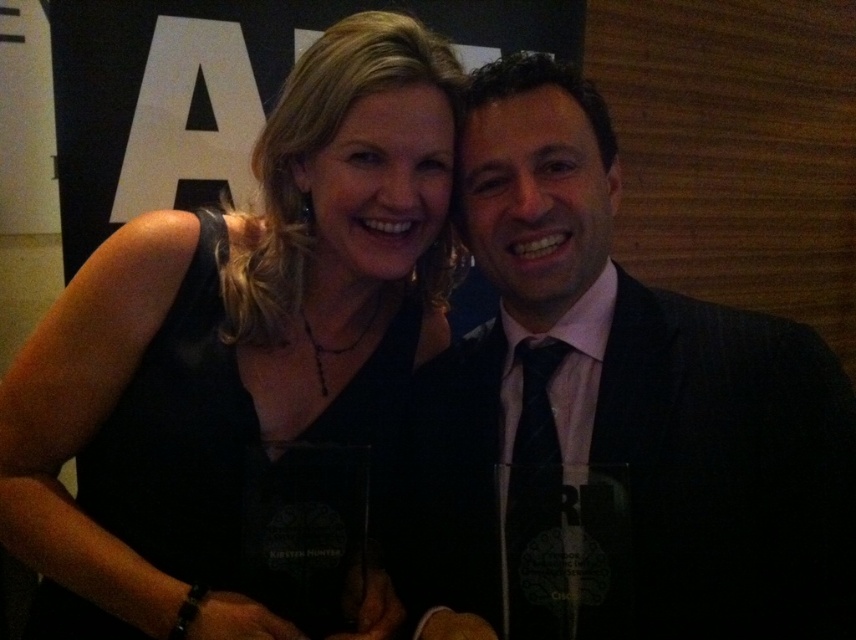
You are a photographer standing 1 meter away from the scene. You want to focus your camera on the black matte dress at center without blurring the people holding awards in the foreground. Is the distance sufficient for your camera to capture both clearly?

The black matte dress at center is 82.94 centimeters away from the viewer. Since you are standing 1 meter away, which is slightly farther than the dress, your camera should be able to focus on the dress while keeping the foreground subjects sharp, as the distance difference is minimal.

You are a photographer trying to adjust the lighting for a group photo. The black suit at right and the black silk tie at center are in your frame. Which object should you focus on first if you need to ensure both are properly lit, considering their sizes?

The black suit at right should be focused on first because its width is larger than the black silk tie at center, making it more prominent and requiring more attention to ensure proper lighting coverage.

You are organizing a photo shoot and need to arrange two outfits side by side on a mannequin. The outfits are the black suit at right and the black matte dress at center. Based on their widths, which outfit should you place on the left side to ensure they fit within a 1.5 meter wide display area?

The black suit at right has a lesser width compared to the black matte dress at center. To fit both outfits within the 1.5 meter display area, place the narrower black suit at right on the left side and the wider black matte dress at center on the right side.